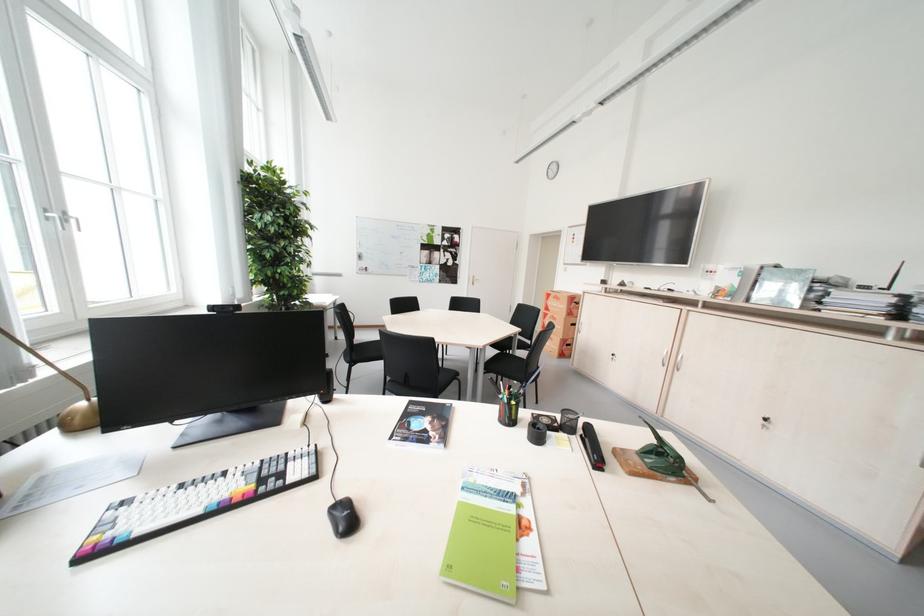
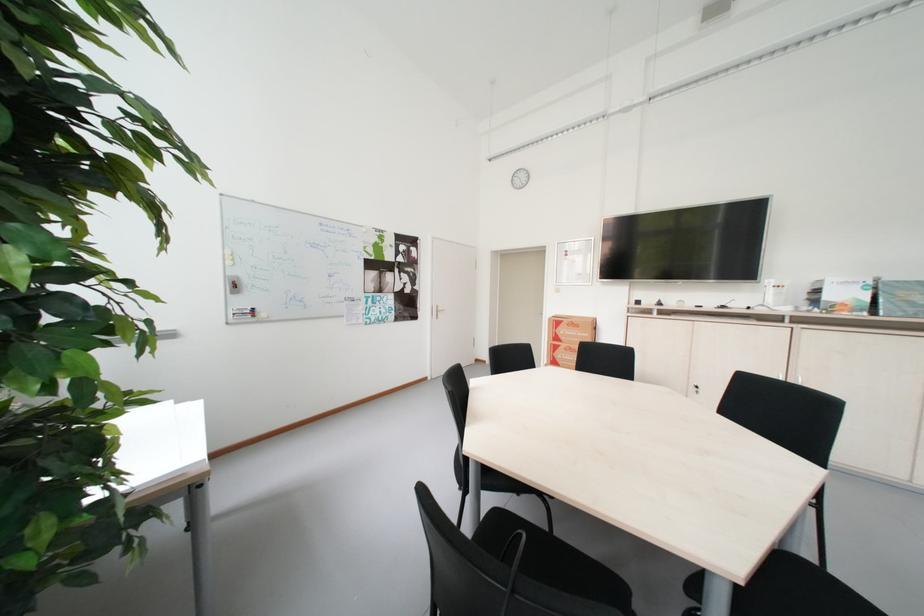
The point at (x=560, y=315) is marked in the first image. Where is the corresponding point in the second image?

(573, 347)